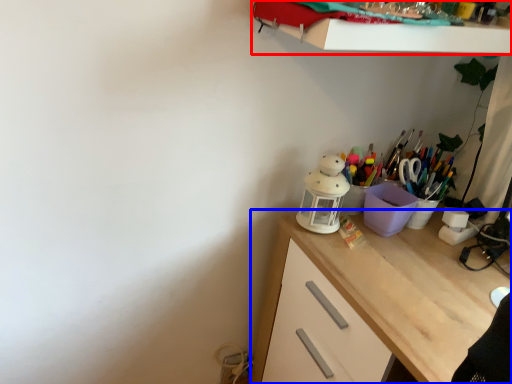
Question: Which object appears farthest to the camera in this image, shelf (highlighted by a red box) or desk (highlighted by a blue box)?

Choices:
 (A) shelf
 (B) desk

Answer: (B)